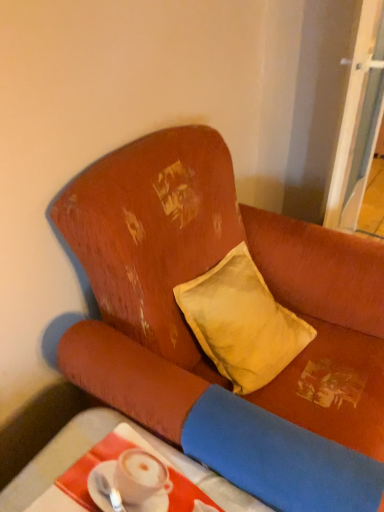
You are a GUI agent. You are given a task and a screenshot of the screen. Output one action in this format:
    pyautogui.click(x=<x>, y=<y>)
    Task: Click on the spots to the right of white glossy spoon at lower left
    
    Given the screenshot: What is the action you would take?
    click(184, 487)